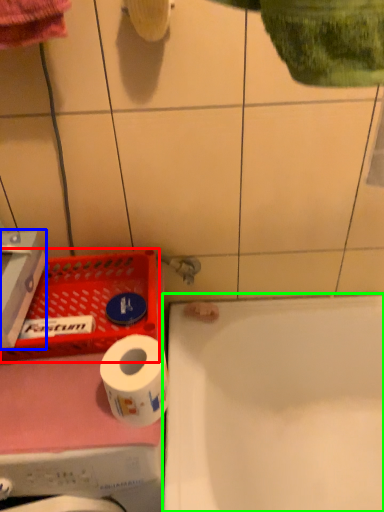
Question: Which object is the closest to the laundry basket (highlighted by a red box)? Choose among these: carton (highlighted by a blue box) or bathtub (highlighted by a green box).

Choices:
 (A) carton
 (B) bathtub

Answer: (A)